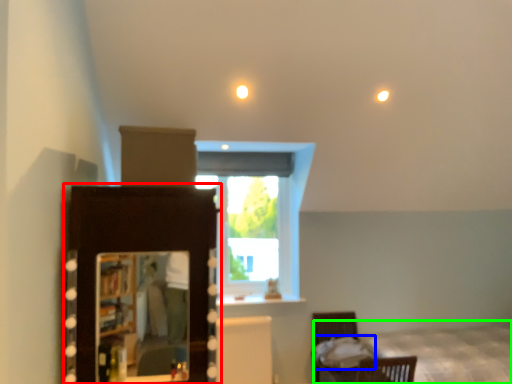
Question: Based on their relative distances, which object is nearer to dresser (highlighted by a red box)? Choose from sheet (highlighted by a blue box) and bed (highlighted by a green box).

Choices:
 (A) sheet
 (B) bed

Answer: (A)